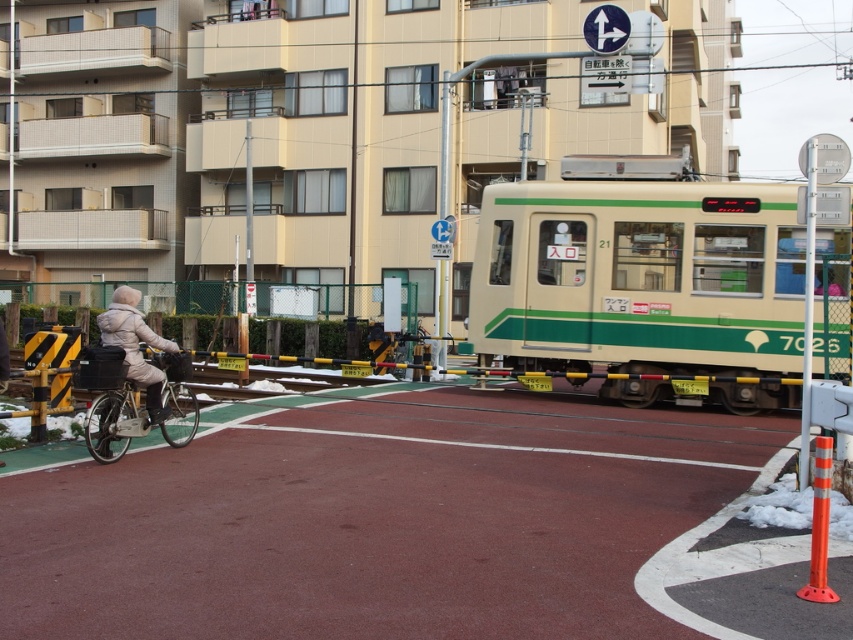
You are a pedestrian standing at the railway crossing. You see a green matte train at center and a matte black bicycle at left. Which object is higher up in the image?

The green matte train at center is higher up in the image because it is positioned above the matte black bicycle at left.

You are a delivery person on a bicycle. You see a green matte train at center and a matte black bicycle at left. The railway tracks are covered with snow. If you need to quickly move your bicycle to the other side of the tracks before the train arrives, is there enough time? Please explain your reasoning based on the distance between them.

The green matte train at center is 21.92 feet from the matte black bicycle at left. Since the train is significantly faster than a bicycle, even though the distance is about 21.92 feet, the train will arrive much sooner than the bicycle can cross. Therefore, there is not enough time to safely move the bicycle to the other side before the train arrives.

You are a delivery driver who needs to park your van near the matte black bicycle at left. The parking space available is 10 meters long. Can you safely park your van there?

The matte black bicycle at left is 9.29 meters away from the camera, so the parking space is 10 meters long, which is longer than the distance to the bicycle. Therefore, you can safely park your van there as there is enough space.